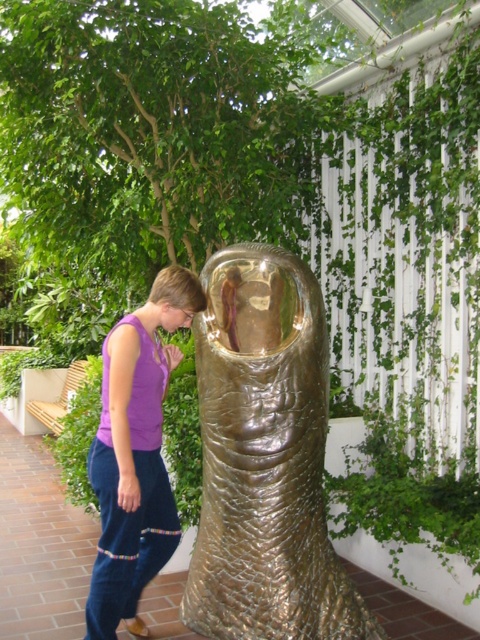
Does gold textured fish at center have a smaller size compared to purple cotton pants at lower left?

Yes.

Does point (291, 582) lie behind point (178, 305)?

No, it is not.

Where is `gold textured fish at center`? This screenshot has height=640, width=480. gold textured fish at center is located at coordinates (264, 458).